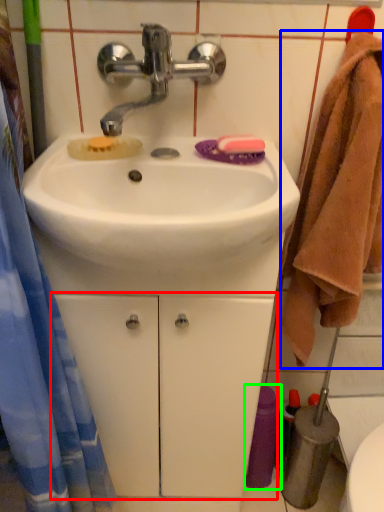
Question: Which is farther away from drawer (highlighted by a red box)? bath towel (highlighted by a blue box) or toiletry (highlighted by a green box)?

Choices:
 (A) bath towel
 (B) toiletry

Answer: (A)